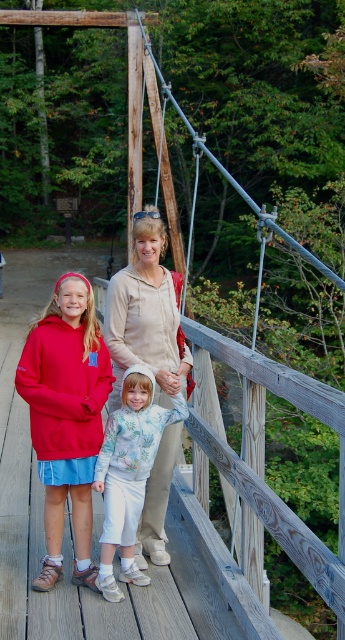
Question: Among these objects, which one is nearest to the camera?

Choices:
 (A) floral sweatshirt at center
 (B) matte red hoodie at left
 (C) matte red hoodie at center

Answer: (C)

Question: Is matte red hoodie at center to the right of floral sweatshirt at center from the viewer's perspective?

Choices:
 (A) yes
 (B) no

Answer: (B)

Question: Is matte red hoodie at left to the left of matte red hoodie at center from the viewer's perspective?

Choices:
 (A) no
 (B) yes

Answer: (A)

Question: Which is farther from the beige cotton hoodie at center?

Choices:
 (A) matte red hoodie at center
 (B) floral sweatshirt at center

Answer: (A)

Question: From the image, what is the correct spatial relationship of matte red hoodie at left in relation to beige cotton hoodie at center?

Choices:
 (A) left
 (B) right

Answer: (A)

Question: Which point appears farthest from the camera in this image?

Choices:
 (A) (121, 444)
 (B) (146, 340)

Answer: (B)